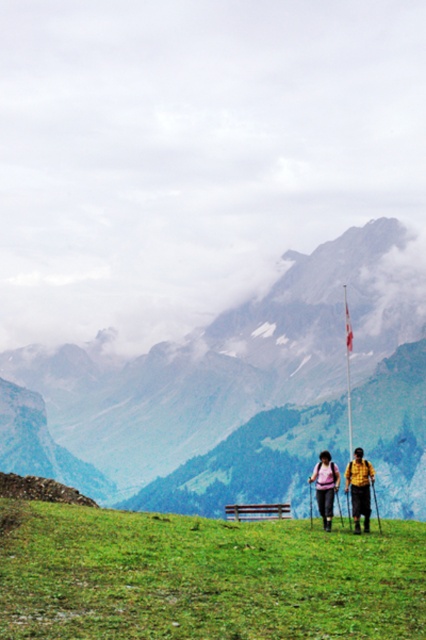
You are standing at the origin point of the coordinate system. Based on the scene, where is the green grassy field at center located in terms of coordinates?

The green grassy field at center is located at coordinates point [204,577].

You are a hiker trying to decide whether to place your yellow fabric backpack at center on top of the white fabric flag at center. Based on their heights, is this possible?

The yellow fabric backpack at center is not as tall as the white fabric flag at center, so it can be placed on top since it is shorter.

You are a hiker who wants to place a 1.5 meter long tent between the green grassy field at center and the yellow fabric backpack at center. Is there enough space between them to fit the tent?

The distance between the green grassy field at center and the yellow fabric backpack at center is 23.32 meters, which is more than enough to fit a 1.5 meter long tent between them.